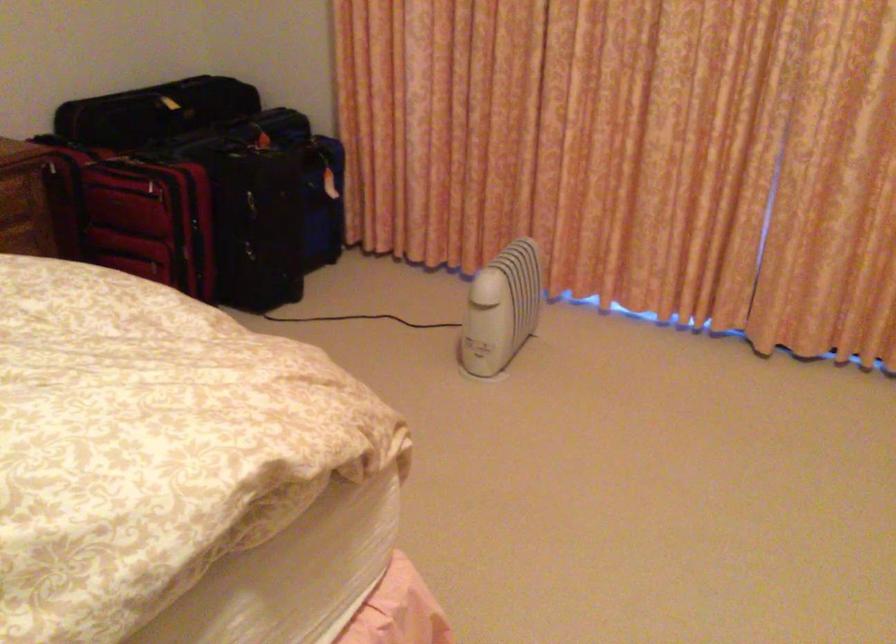
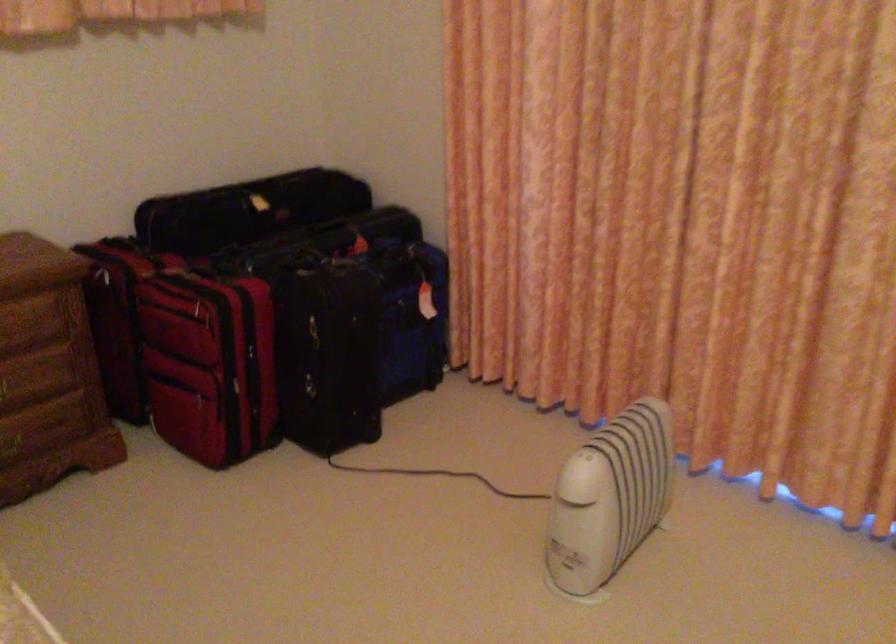
Question: The images are taken continuously from a first-person perspective. In which direction is your viewpoint rotating?

Choices:
 (A) Left
 (B) Right
 (C) Up
 (D) Down

Answer: (A)